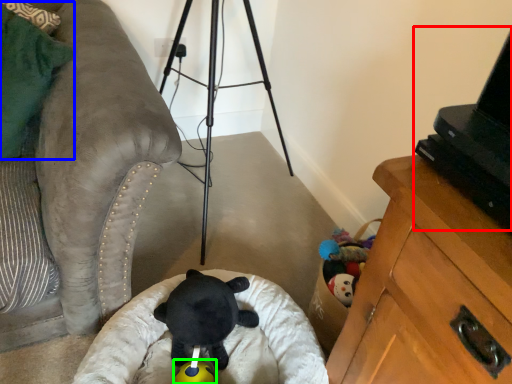
Question: Based on their relative distances, which object is farther from computer (highlighted by a red box)? Choose from pillow (highlighted by a blue box) and toy (highlighted by a green box).

Choices:
 (A) pillow
 (B) toy

Answer: (A)